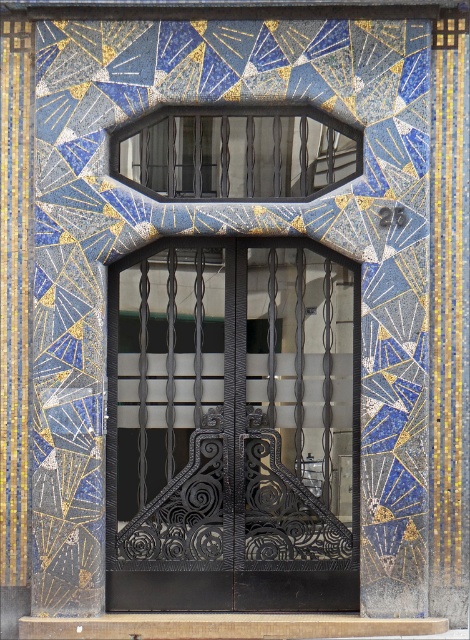
You are standing in front of the entrance and want to locate the black wrought iron door at center. Where would you look relative to the matte black glass at upper center?

The black wrought iron door at center is located below the matte black glass at upper center.

You are an architect designing a new building entrance. You need to ensure that the black wrought iron door at center and the matte black glass at upper center are proportionate. Based on the existing design, which object should be placed higher to maintain balance?

The black wrought iron door at center is taller than the matte black glass at upper center, so to maintain balance, the matte black glass at upper center should be placed higher since it is shorter in height.